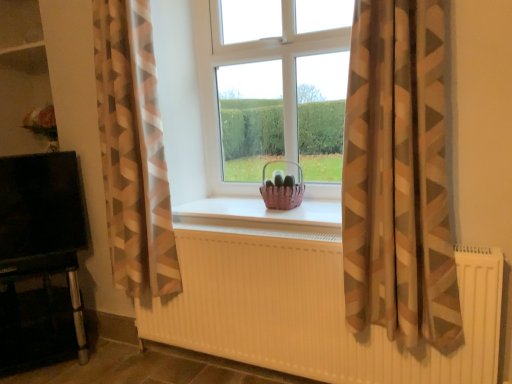
Locate an element on the screen. This screenshot has width=512, height=384. vacant space in front of pink woven basket at center is located at coordinates (283, 211).